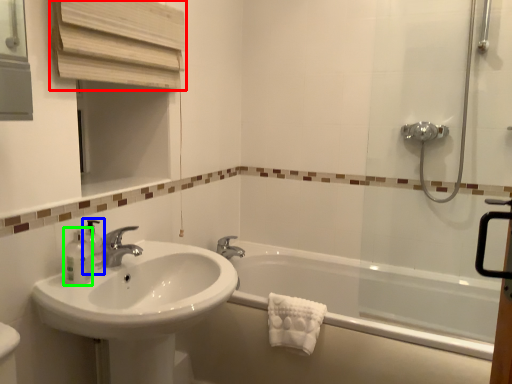
Question: Estimate the real-world distances between objects in this image. Which object is closer to medicine cabinet (highlighted by a red box), soap dispenser (highlighted by a blue box) or toiletry (highlighted by a green box)?

Choices:
 (A) soap dispenser
 (B) toiletry

Answer: (A)